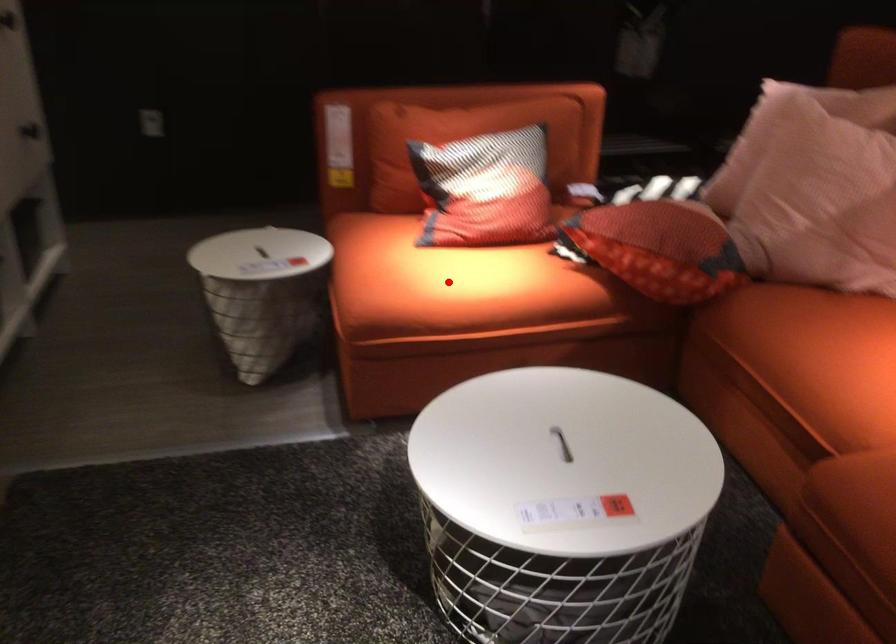
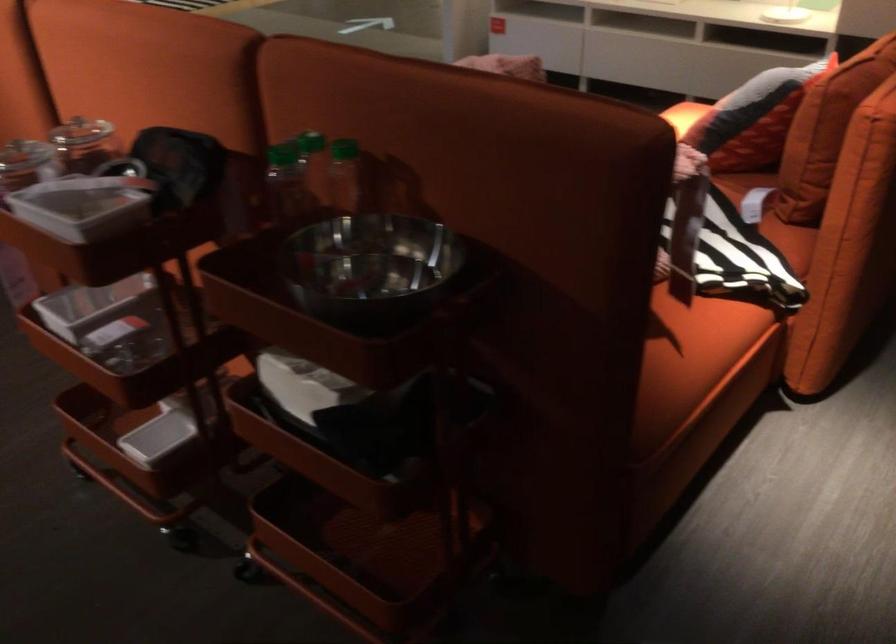
Question: I am providing you with two images of the same scene from different viewpoints. A red point is marked on the first image. Can you still see the location of the red point in image 2?

Choices:
 (A) Yes
 (B) No

Answer: (B)